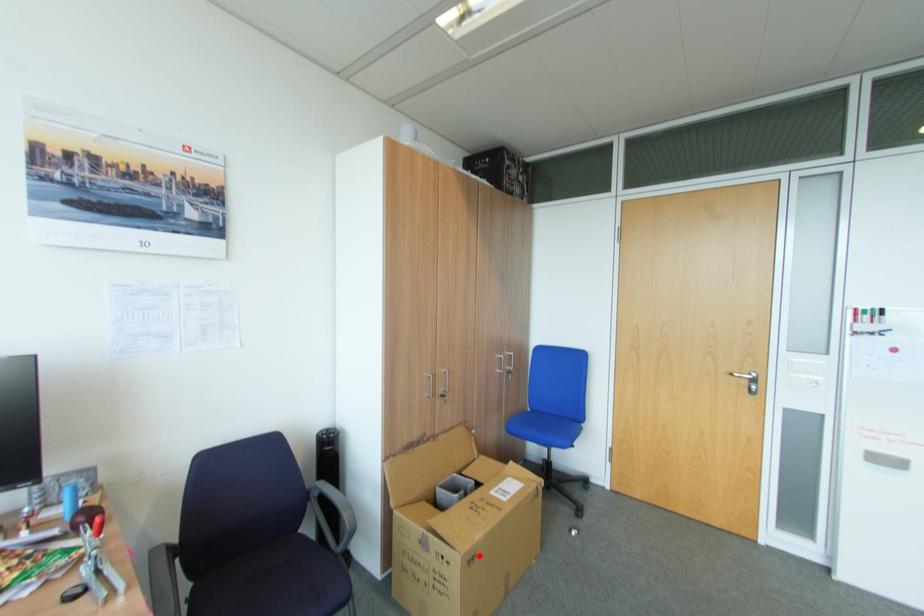
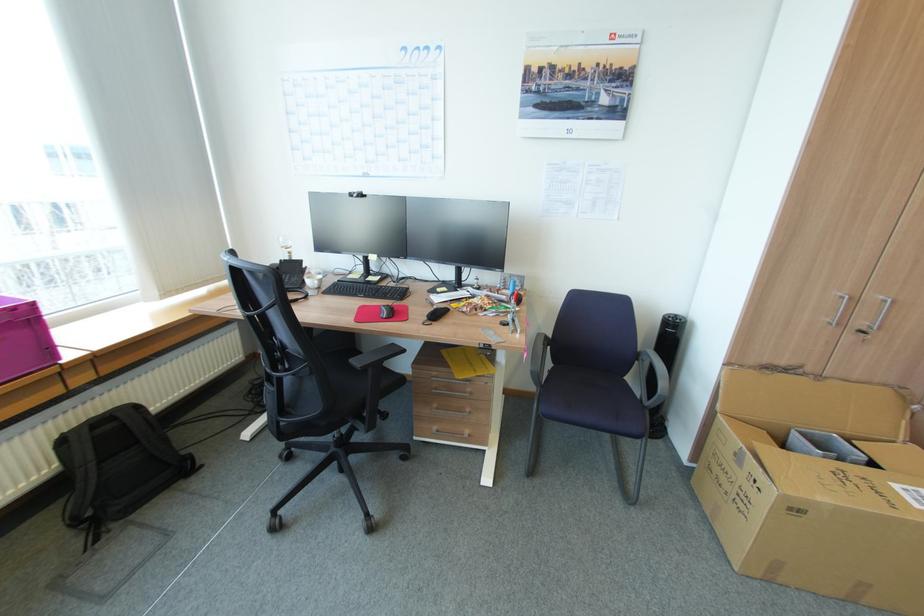
Question: I am providing you with two images of the same scene from different viewpoints. Image1 has a red point marked. In image2, the corresponding 3D location appears at what relative position? Reply with the corresponding letter.

Choices:
 (A) Closer
 (B) Farther

Answer: (A)